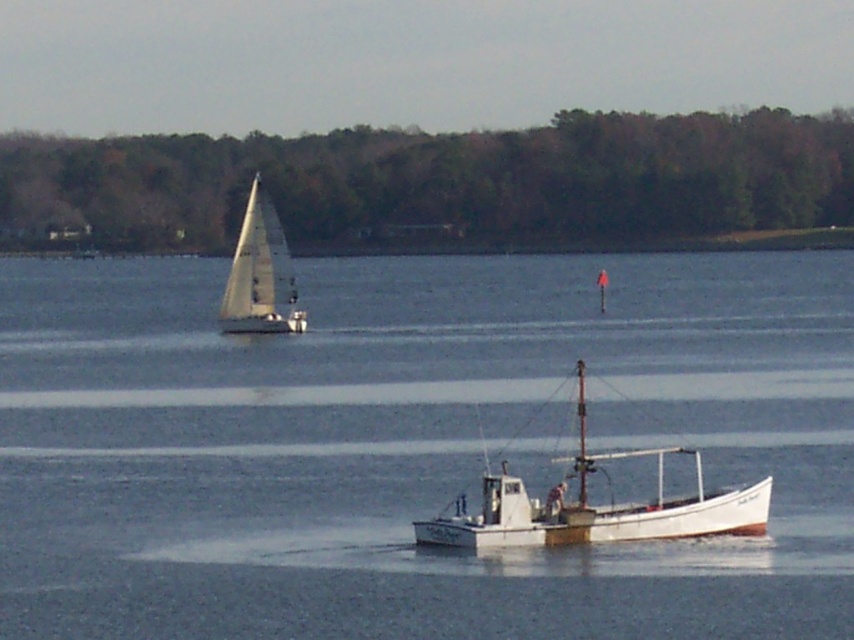
Between white wooden boat at center and white sailboat at upper left, which one has less height?

white wooden boat at center

Does point (455, 515) lie behind point (237, 280)?

No, (455, 515) is closer to viewer.

What are the coordinates of `white wooden boat at center` in the screenshot? It's located at (594, 506).

Is white matte water at center to the right of white sailboat at upper left from the viewer's perspective?

Indeed, white matte water at center is positioned on the right side of white sailboat at upper left.

Can you confirm if white matte water at center is bigger than white sailboat at upper left?

Indeed, white matte water at center has a larger size compared to white sailboat at upper left.

Describe the element at coordinates (410, 445) in the screenshot. This screenshot has width=854, height=640. I see `white matte water at center` at that location.

This screenshot has height=640, width=854. In order to click on white matte water at center in this screenshot , I will do `click(410, 445)`.

Can you confirm if white matte water at center is positioned to the right of white wooden boat at center?

Incorrect, white matte water at center is not on the right side of white wooden boat at center.

How much distance is there between white matte water at center and white wooden boat at center?

white matte water at center and white wooden boat at center are 178.33 feet apart from each other.

Is point (206, 596) positioned after point (651, 524)?

No, (206, 596) is closer to viewer.

At what (x,y) coordinates should I click in order to perform the action: click on white matte water at center. Please return your answer as a coordinate pair (x, y). Image resolution: width=854 pixels, height=640 pixels. Looking at the image, I should click on (410, 445).